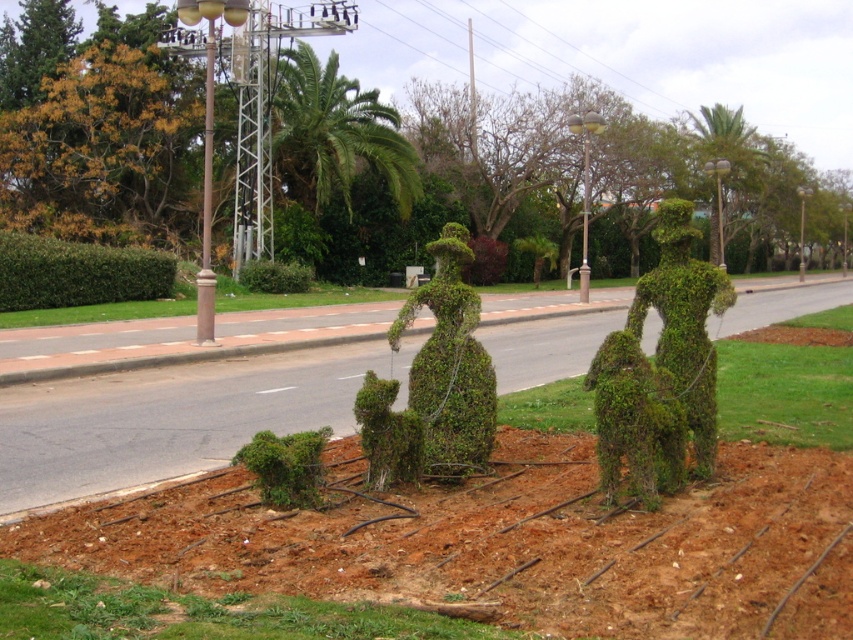
From the picture: You are a gardener who needs to trim the bushes to ensure they are all the same height. Which of the two bushes, the green leafy bush at lower left or the green leafy bush at center, requires more trimming?

The green leafy bush at lower left requires less trimming since it is not as tall as the green leafy bush at center, which needs more trimming to match the desired height.

You are a gardener standing at the lower edge of the image. You need to reach the green leafy bush at center to trim it. Is the green grass at lower left an obstacle in your path?

The green grass at lower left is below the green leafy bush at center, so it is located under the bush. Since you are standing at the lower edge, the grass would be in front of the bush, making it an obstacle in your path to reach the bush.